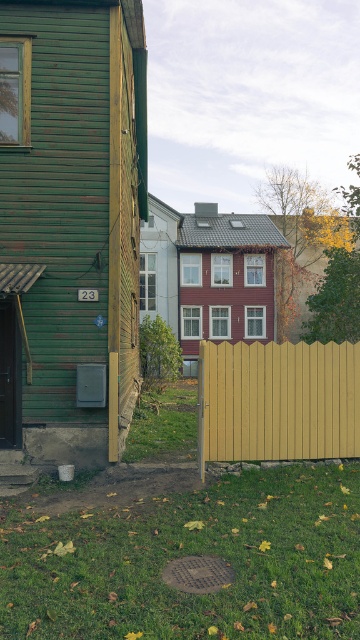
Does point (75, 589) come behind point (275, 404)?

No, (75, 589) is closer to viewer.

Does green grass at lower center appear under yellow wood fence at center?

Indeed, green grass at lower center is positioned under yellow wood fence at center.

Image resolution: width=360 pixels, height=640 pixels. I want to click on green grass at lower center, so click(191, 554).

What are the coordinates of `green grass at lower center` in the screenshot? It's located at (191, 554).